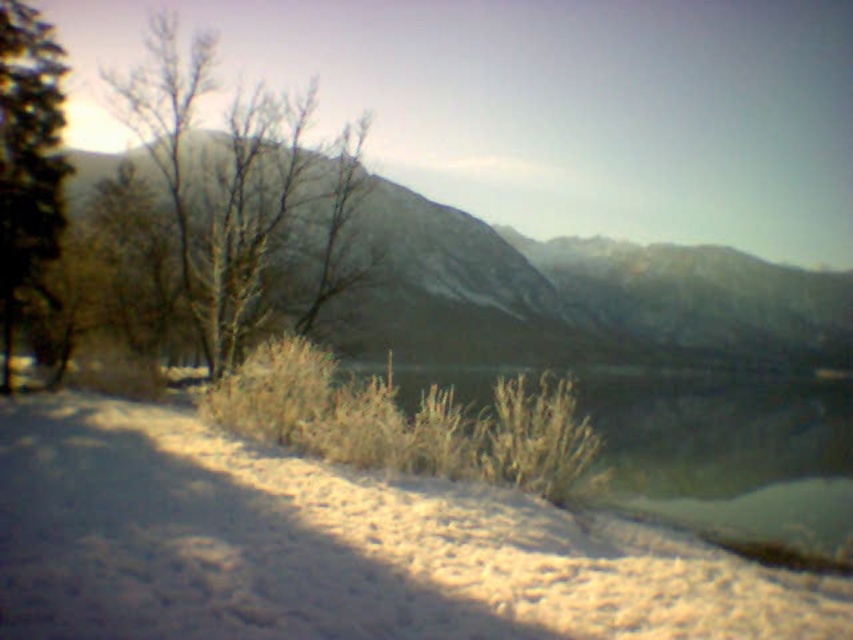
Question: Which object is positioned closest to the bare branches at center?

Choices:
 (A) white fluffy snow at lower center
 (B) clear water at lower center

Answer: (A)

Question: Is white fluffy snow at lower center above green matte tree at left?

Choices:
 (A) yes
 (B) no

Answer: (B)

Question: Can you confirm if smooth gray rock at center is positioned to the right of clear water at lower center?

Choices:
 (A) yes
 (B) no

Answer: (A)

Question: Is green matte tree at left positioned before bare branches at center?

Choices:
 (A) no
 (B) yes

Answer: (B)

Question: Estimate the real-world distances between objects in this image. Which object is closer to the smooth gray rock at center?

Choices:
 (A) green matte tree at left
 (B) clear water at lower center
 (C) bare branches at center

Answer: (B)

Question: Which point is farther to the camera?

Choices:
 (A) (364, 522)
 (B) (173, 54)

Answer: (B)